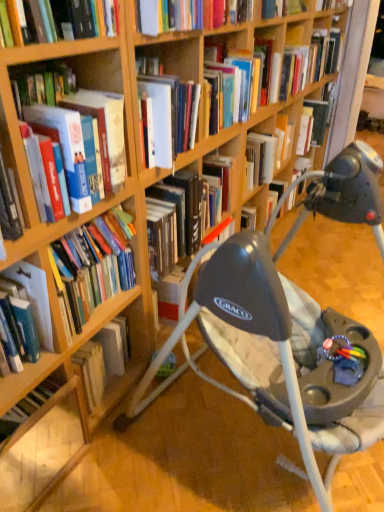
Question: Is hardcover book at left, the 4th book viewed from the right, outside of hardcover book at upper right, arranged as the second book when viewed from the top?

Choices:
 (A) no
 (B) yes

Answer: (B)

Question: Can you confirm if hardcover book at left, the third book positioned from the front, is positioned to the left of hardcover book at upper right, the fourth book from the left?

Choices:
 (A) no
 (B) yes

Answer: (B)

Question: From the image's perspective, is hardcover book at left, the third book positioned from the front, beneath hardcover book at upper right, arranged as the second book when viewed from the top?

Choices:
 (A) yes
 (B) no

Answer: (A)

Question: From a real-world perspective, is hardcover book at left, positioned as the 2th book in left-to-right order, physically below hardcover book at upper right, arranged as the second book when viewed from the top?

Choices:
 (A) yes
 (B) no

Answer: (B)

Question: Is hardcover book at left, the third book from the back, turned away from hardcover book at upper right, arranged as the second book when viewed from the top?

Choices:
 (A) no
 (B) yes

Answer: (A)

Question: Is hardcover book at left, the third book positioned from the front, at the right side of hardcover book at upper right, which is the fourth book in bottom-to-top order?

Choices:
 (A) no
 (B) yes

Answer: (A)

Question: Can you confirm if hardcover book at left, which ranks as the fourth book in top-to-bottom order, is thinner than hardcover book at upper right, marked as the 5th book in a left-to-right arrangement?

Choices:
 (A) yes
 (B) no

Answer: (B)

Question: Does hardcover book at left, which is the 2th book from bottom to top, appear on the left side of hardcover book at upper right, placed as the first book when sorted from top to bottom?

Choices:
 (A) no
 (B) yes

Answer: (B)

Question: Does hardcover book at left, the 4th book viewed from the right, turn towards hardcover book at upper right, placed as the first book when sorted from top to bottom?

Choices:
 (A) yes
 (B) no

Answer: (B)

Question: Does hardcover book at left, which is the 2th book from bottom to top, come behind hardcover book at upper right, marked as the 1th book in a back-to-front arrangement?

Choices:
 (A) no
 (B) yes

Answer: (A)

Question: Considering the relative sizes of hardcover book at left, which is the 2th book from bottom to top, and hardcover book at upper right, placed as the first book when sorted from top to bottom, in the image provided, is hardcover book at left, which is the 2th book from bottom to top, bigger than hardcover book at upper right, placed as the first book when sorted from top to bottom,?

Choices:
 (A) yes
 (B) no

Answer: (A)

Question: Is hardcover book at upper right, the 5th book in the front-to-back sequence, inside hardcover book at left, which ranks as the fourth book in top-to-bottom order?

Choices:
 (A) yes
 (B) no

Answer: (B)

Question: Is hardcover book at left, which is the 5th book in back-to-front order, shorter than hardcover book at lower left, the 4th book in the back-to-front sequence?

Choices:
 (A) no
 (B) yes

Answer: (B)